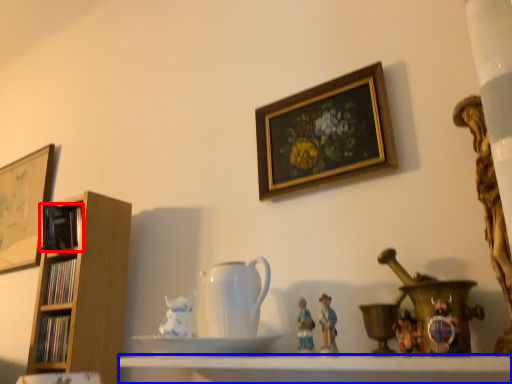
Question: Which object appears farthest to the camera in this image, book (highlighted by a red box) or shelf (highlighted by a blue box)?

Choices:
 (A) book
 (B) shelf

Answer: (A)